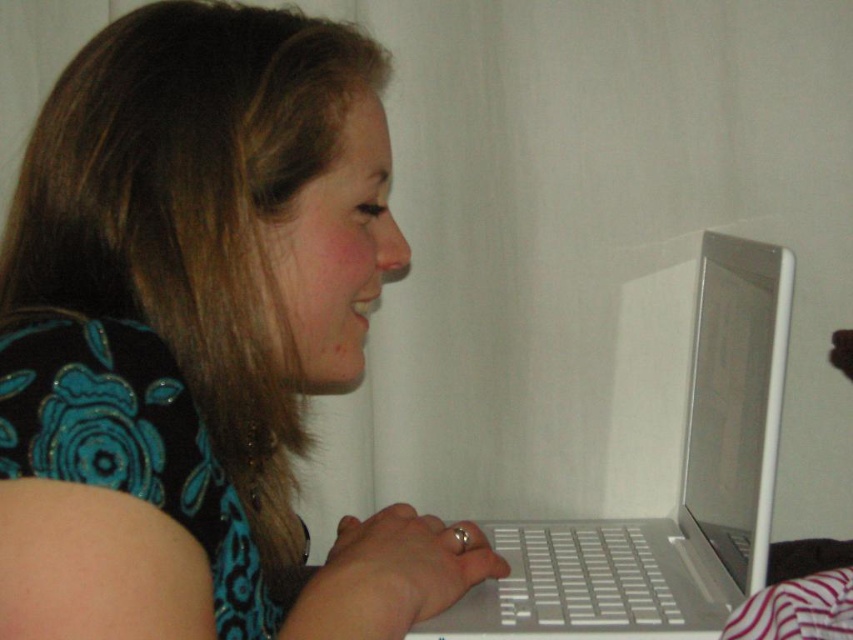
You are trying to decide which laptop to choose between the white plastic laptop at center and the white glossy laptop at center. Based on their sizes, which one would you pick if you prefer a bigger screen for multitasking?

The white plastic laptop at center has a larger size compared to the white glossy laptop at center, so you should pick the white plastic laptop at center for a bigger screen.

You are a delivery robot trying to place a package on the desk. The desk has a white plastic laptop at center. Where should you place the package so it doesn not block the laptop?

The white plastic laptop at center is located at point (662, 468). To avoid blocking it, place the package away from that coordinate.